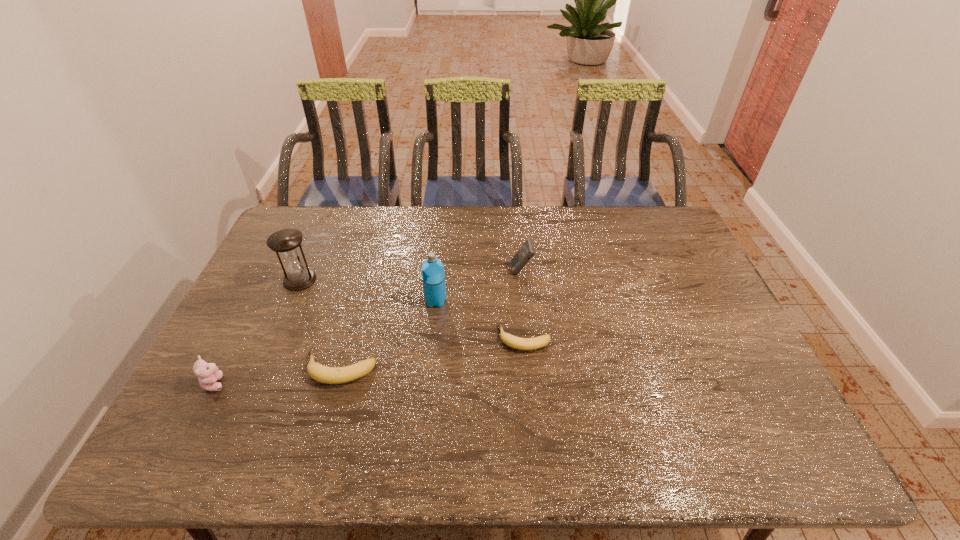
The image size is (960, 540). Find the location of `empty location between the third farthest object and the hourglass`. empty location between the third farthest object and the hourglass is located at coordinates (368, 291).

Locate an element on the screen. This screenshot has height=540, width=960. vacant area that lies between the third object from right to left and the teddy bear is located at coordinates point(325,342).

Where is `vacant area that lies between the calculator and the shortest object`? The height and width of the screenshot is (540, 960). vacant area that lies between the calculator and the shortest object is located at coordinates (523, 305).

Find the location of a particular element. vacant area that lies between the thermos bottle and the shorter banana is located at coordinates (480, 320).

Where is `unoccupied position between the fourth object from left to right and the second object from left to right`? Image resolution: width=960 pixels, height=540 pixels. unoccupied position between the fourth object from left to right and the second object from left to right is located at coordinates (368, 291).

Locate an element on the screen. This screenshot has width=960, height=540. free space between the taller banana and the teddy bear is located at coordinates (277, 376).

At what (x,y) coordinates should I click in order to perform the action: click on empty space between the third farthest object and the fourth object from right to left. Please return your answer as a coordinate pair (x, y). The image size is (960, 540). Looking at the image, I should click on (388, 335).

Locate an element on the screen. vacant point located between the right banana and the calculator is located at coordinates (523, 305).

This screenshot has height=540, width=960. In order to click on the closest object to the shorter banana in this screenshot , I will do `click(433, 276)`.

Select which object appears as the fifth closest to the leftmost object. Please provide its 2D coordinates. Your answer should be formatted as a tuple, i.e. [(x, y)], where the tuple contains the x and y coordinates of a point satisfying the conditions above.

[(526, 252)]